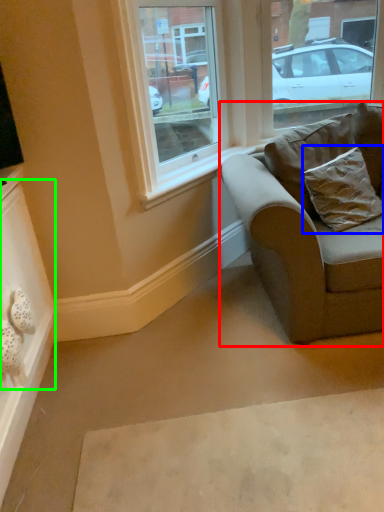
Question: Estimate the real-world distances between objects in this image. Which object is closer to studio couch (highlighted by a red box), pillow (highlighted by a blue box) or drawer (highlighted by a green box)?

Choices:
 (A) pillow
 (B) drawer

Answer: (A)